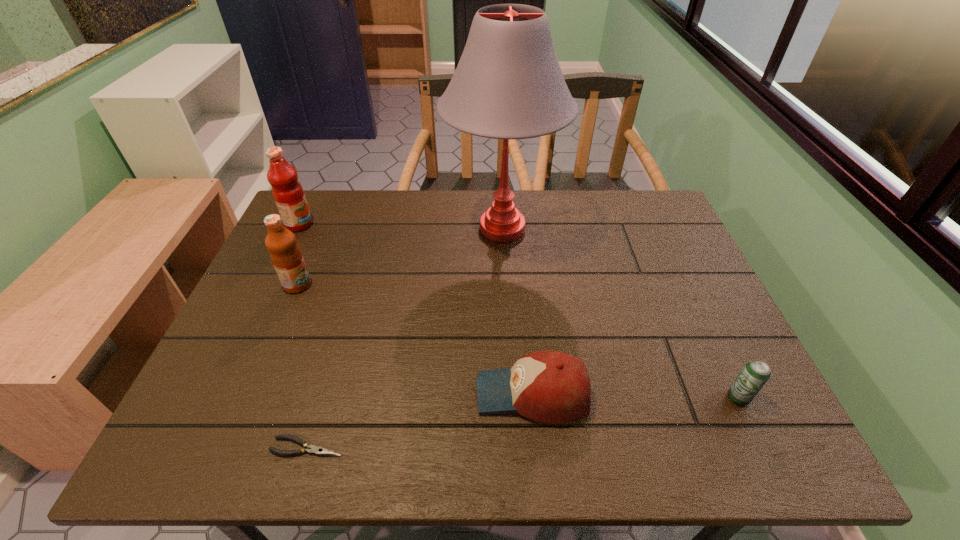
This screenshot has height=540, width=960. Find the location of `free spot that satisfies the following two spatial constraints: 1. on the front label of the farther fruit juice; 2. on the back side of the pliers`. free spot that satisfies the following two spatial constraints: 1. on the front label of the farther fruit juice; 2. on the back side of the pliers is located at coordinates (192, 447).

This screenshot has width=960, height=540. What are the coordinates of `vacant position in the image that satisfies the following two spatial constraints: 1. on the front label of the farther fruit juice; 2. on the right side of the beer can` in the screenshot? It's located at (215, 398).

This screenshot has height=540, width=960. Identify the location of vacant space that satisfies the following two spatial constraints: 1. on the front label of the fourth shortest object; 2. on the right side of the pliers. pos(229,447).

Image resolution: width=960 pixels, height=540 pixels. Identify the location of vacant space that satisfies the following two spatial constraints: 1. on the back side of the nearest object; 2. on the left side of the beer can. (322, 398).

Locate an element on the screen. This screenshot has height=540, width=960. vacant space that satisfies the following two spatial constraints: 1. on the front-facing side of the rightmost object; 2. on the right side of the baseball cap is located at coordinates (533, 398).

Locate an element on the screen. free point that satisfies the following two spatial constraints: 1. on the front-facing side of the tallest object; 2. on the right side of the rightmost object is located at coordinates (512, 398).

This screenshot has height=540, width=960. I want to click on vacant position in the image that satisfies the following two spatial constraints: 1. on the front label of the pliers; 2. on the left side of the fourth shortest object, so click(229, 447).

At what (x,y) coordinates should I click in order to perform the action: click on free space that satisfies the following two spatial constraints: 1. on the back side of the pliers; 2. on the front label of the fourth nearest object. Please return your answer as a coordinate pair (x, y). This screenshot has width=960, height=540. Looking at the image, I should click on (354, 285).

The image size is (960, 540). I want to click on free space that satisfies the following two spatial constraints: 1. on the back side of the rightmost object; 2. on the front-facing side of the baseball cap, so (x=736, y=394).